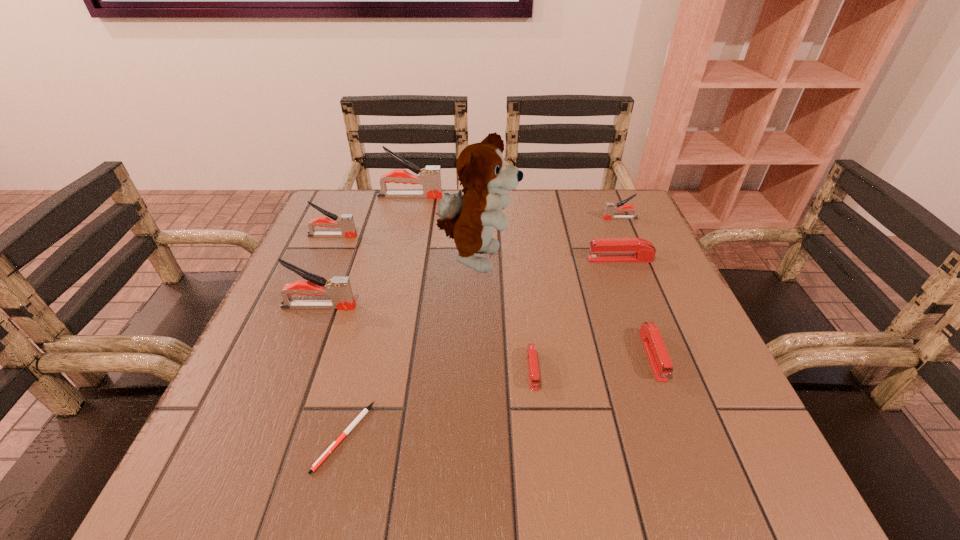
Identify the location of free space that is in between the sixth tallest stapler and the eighth tallest object. This screenshot has width=960, height=540. (592, 363).

I want to click on free space between the farthest stapler and the second smallest gray stapler, so click(372, 216).

Where is `vacant area that lies between the fifth object from left to right and the sixth nearest stapler`? This screenshot has width=960, height=540. vacant area that lies between the fifth object from left to right and the sixth nearest stapler is located at coordinates (548, 239).

Find the location of a particular element. The height and width of the screenshot is (540, 960). empty location between the tallest object and the nearest gray stapler is located at coordinates (397, 284).

Locate an element on the screen. The height and width of the screenshot is (540, 960). free point between the second shortest stapler and the nearest object is located at coordinates (498, 396).

At what (x,y) coordinates should I click in order to perform the action: click on vacant region between the smallest red stapler and the third nearest gray stapler. Please return your answer as a coordinate pair (x, y). Image resolution: width=960 pixels, height=540 pixels. Looking at the image, I should click on (576, 294).

Where is `empty space between the smallest red stapler and the sixth tallest object`? empty space between the smallest red stapler and the sixth tallest object is located at coordinates pos(576,315).

Find the location of a particular element. The height and width of the screenshot is (540, 960). unoccupied position between the third shortest object and the tallest stapler is located at coordinates (531, 276).

Find the location of a particular element. The width and height of the screenshot is (960, 540). free spot between the nearest object and the fifth shortest object is located at coordinates (482, 327).

I want to click on object that is the nearest to the third farthest gray stapler, so click(430, 177).